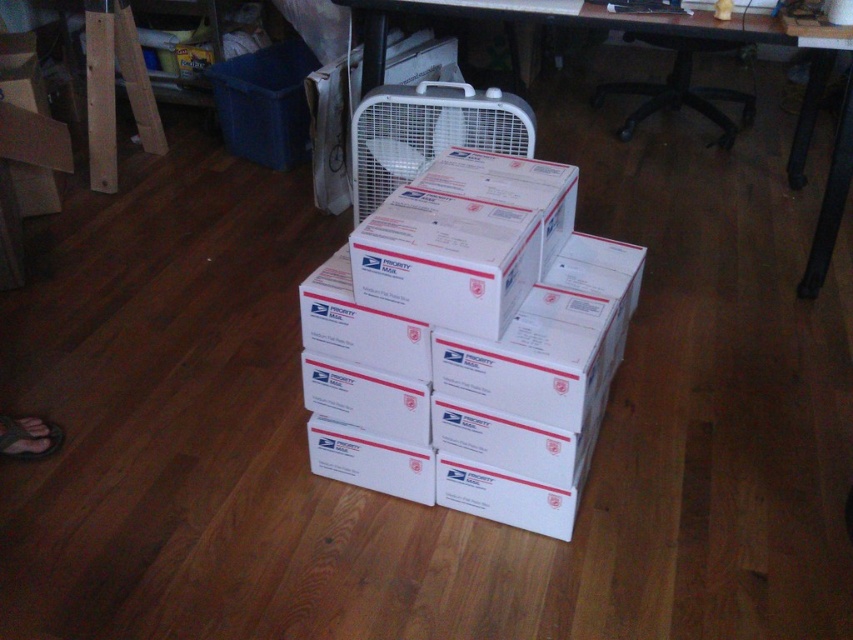
Question: Which of the following is the closest to the observer?

Choices:
 (A) white cardboard boxes at center
 (B) white plastic computer desk at upper center

Answer: (A)

Question: In this image, where is white cardboard boxes at center located relative to white plastic computer desk at upper center?

Choices:
 (A) right
 (B) left

Answer: (B)

Question: Where is white cardboard boxes at center located in relation to white plastic computer desk at upper center in the image?

Choices:
 (A) left
 (B) right

Answer: (A)

Question: Does white cardboard boxes at center have a smaller size compared to white plastic computer desk at upper center?

Choices:
 (A) no
 (B) yes

Answer: (B)

Question: Among these points, which one is farthest from the camera?

Choices:
 (A) (811, 128)
 (B) (456, 432)

Answer: (A)

Question: Which of the following is the farthest from the observer?

Choices:
 (A) white plastic computer desk at upper center
 (B) white cardboard boxes at center

Answer: (A)